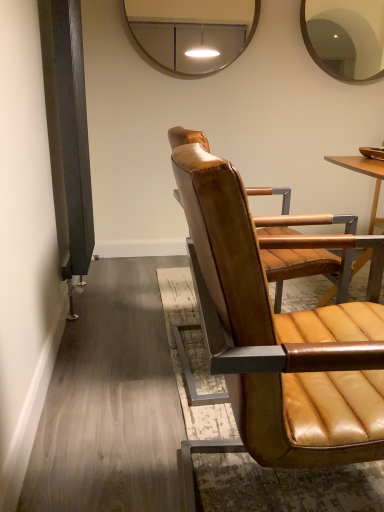
Question: Is point (354, 27) closer or farther from the camera than point (218, 320)?

Choices:
 (A) closer
 (B) farther

Answer: (B)

Question: Is matte brown mirror at upper right, marked as the first mirror in a right-to-left arrangement, situated inside matte brown leather chair at center or outside?

Choices:
 (A) outside
 (B) inside

Answer: (A)

Question: Based on their relative distances, which object is nearer to the metallic silver mirror at upper center, which is the 1th mirror from left to right?

Choices:
 (A) matte brown mirror at upper right, the second mirror viewed from the left
 (B) matte brown leather chair at center

Answer: (A)

Question: Which object is positioned closest to the matte brown leather chair at center?

Choices:
 (A) metallic silver mirror at upper center, which is the 1th mirror from left to right
 (B) matte brown mirror at upper right, marked as the first mirror in a right-to-left arrangement

Answer: (B)